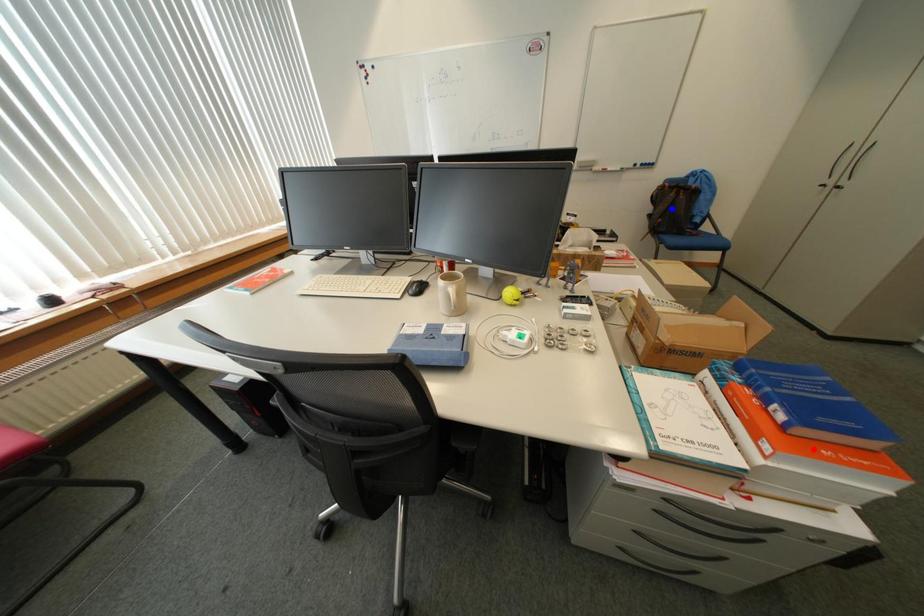
Question: In the image, two points are highlighted. Which point is nearer to the camera? Reply with the corresponding letter.

Choices:
 (A) blue point
 (B) red point

Answer: (B)